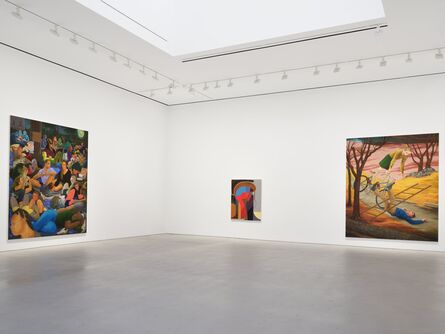
Locate an element on the screen. The image size is (445, 334). corner of painting on the left is located at coordinates coord(11,115), coord(9,239), coord(85,231), coord(88,130).